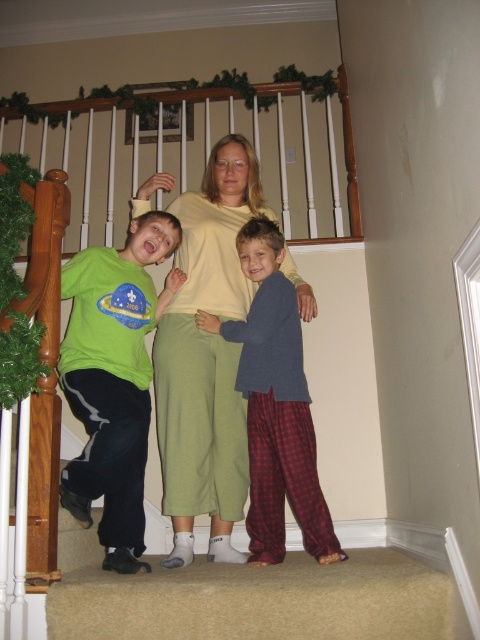
Question: Among these objects, which one is farthest from the camera?

Choices:
 (A) carpet at lower center
 (B) matte green shirt at left
 (C) light yellow knit sweater at center
 (D) blue fleece sweater at center

Answer: (C)

Question: Is light yellow knit sweater at center positioned behind carpet at lower center?

Choices:
 (A) yes
 (B) no

Answer: (A)

Question: Is carpet at lower center smaller than matte green shirt at left?

Choices:
 (A) yes
 (B) no

Answer: (A)

Question: Does carpet at lower center come behind matte green shirt at left?

Choices:
 (A) no
 (B) yes

Answer: (A)

Question: Which object is positioned farthest from the light yellow knit sweater at center?

Choices:
 (A) carpet at lower center
 (B) matte green shirt at left
 (C) blue fleece sweater at center

Answer: (A)

Question: Which object is farther from the camera taking this photo?

Choices:
 (A) light yellow knit sweater at center
 (B) matte green shirt at left
 (C) carpet at lower center

Answer: (A)